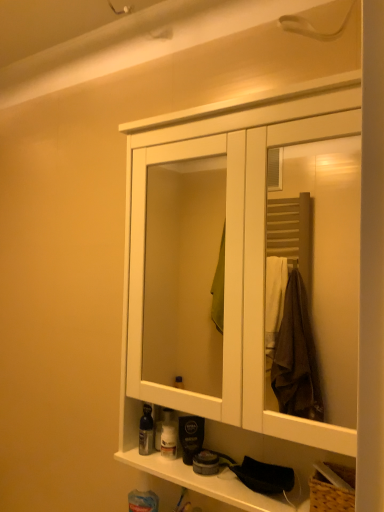
Question: Should I look upward or downward to see white wood cabinet at center?

Choices:
 (A) down
 (B) up

Answer: (A)

Question: Which direction should I rotate to look at translucent plastic bottle at lower center, which is counted as the 1th toiletry, starting from the right, — up or down?

Choices:
 (A) down
 (B) up

Answer: (A)

Question: Can you confirm if shiny silver bottle at lower left, acting as the 2th toiletry starting from the right, is bigger than translucent plastic bottle at lower center, the 2th toiletry from the left?

Choices:
 (A) no
 (B) yes

Answer: (A)

Question: From a real-world perspective, is shiny silver bottle at lower left, acting as the 2th toiletry starting from the right, beneath translucent plastic bottle at lower center, the 2th toiletry from the left?

Choices:
 (A) yes
 (B) no

Answer: (B)

Question: From the image's perspective, would you say shiny silver bottle at lower left, positioned as the first toiletry in left-to-right order, is shown under translucent plastic bottle at lower center, the 2th toiletry from the left?

Choices:
 (A) no
 (B) yes

Answer: (A)

Question: Considering the relative sizes of shiny silver bottle at lower left, acting as the 2th toiletry starting from the right, and translucent plastic bottle at lower center, which is counted as the 1th toiletry, starting from the right, in the image provided, is shiny silver bottle at lower left, acting as the 2th toiletry starting from the right, wider than translucent plastic bottle at lower center, which is counted as the 1th toiletry, starting from the right,?

Choices:
 (A) no
 (B) yes

Answer: (B)

Question: From a real-world perspective, is shiny silver bottle at lower left, acting as the 2th toiletry starting from the right, over translucent plastic bottle at lower center, the 2th toiletry from the left?

Choices:
 (A) no
 (B) yes

Answer: (B)

Question: Is shiny silver bottle at lower left, positioned as the first toiletry in left-to-right order, looking in the opposite direction of translucent plastic bottle at lower center, the 2th toiletry from the left?

Choices:
 (A) no
 (B) yes

Answer: (A)

Question: From a real-world perspective, is translucent plastic bottle at lower center, the 2th toiletry from the left, under shiny silver bottle at lower left, positioned as the first toiletry in left-to-right order?

Choices:
 (A) no
 (B) yes

Answer: (B)

Question: Is translucent plastic bottle at lower center, the 2th toiletry from the left, facing towards shiny silver bottle at lower left, positioned as the first toiletry in left-to-right order?

Choices:
 (A) yes
 (B) no

Answer: (B)

Question: From the image's perspective, is translucent plastic bottle at lower center, the 2th toiletry from the left, located beneath shiny silver bottle at lower left, positioned as the first toiletry in left-to-right order?

Choices:
 (A) yes
 (B) no

Answer: (A)

Question: Is translucent plastic bottle at lower center, the 2th toiletry from the left, not inside shiny silver bottle at lower left, acting as the 2th toiletry starting from the right?

Choices:
 (A) yes
 (B) no

Answer: (A)

Question: Is translucent plastic bottle at lower center, the 2th toiletry from the left, positioned behind shiny silver bottle at lower left, positioned as the first toiletry in left-to-right order?

Choices:
 (A) yes
 (B) no

Answer: (A)

Question: Is translucent plastic bottle at lower center, which is counted as the 1th toiletry, starting from the right, placed right next to shiny silver bottle at lower left, positioned as the first toiletry in left-to-right order?

Choices:
 (A) no
 (B) yes

Answer: (B)

Question: Can you confirm if shiny silver bottle at lower left, positioned as the first toiletry in left-to-right order, is bigger than white wood cabinet at center?

Choices:
 (A) no
 (B) yes

Answer: (A)